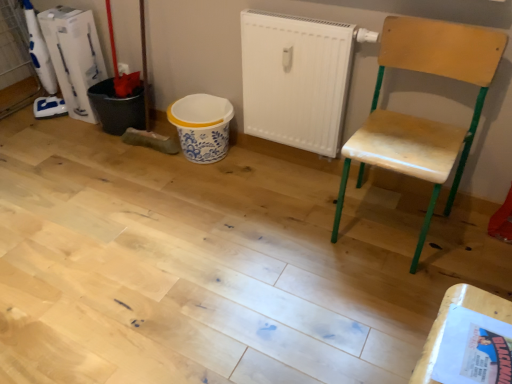
Locate an element on the screen. free space above wooden table at lower right (from a real-world perspective) is located at coordinates (481, 350).